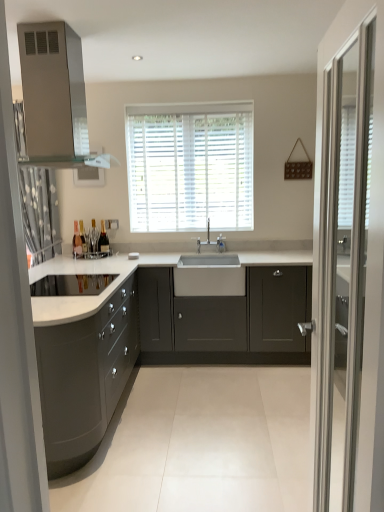
Question: From a real-world perspective, is satin nickel faucet at center over matte glass bottle at left, acting as the third bottle starting from the right?

Choices:
 (A) no
 (B) yes

Answer: (B)

Question: Is satin nickel faucet at center further to the viewer compared to matte glass bottle at left, acting as the third bottle starting from the right?

Choices:
 (A) no
 (B) yes

Answer: (B)

Question: Does satin nickel faucet at center have a larger size compared to matte glass bottle at left, acting as the third bottle starting from the right?

Choices:
 (A) no
 (B) yes

Answer: (B)

Question: Is matte glass bottle at left, which is the first bottle from left to right, completely or partially inside satin nickel faucet at center?

Choices:
 (A) yes
 (B) no

Answer: (B)

Question: Is satin nickel faucet at center turned away from matte glass bottle at left, which is the first bottle from left to right?

Choices:
 (A) no
 (B) yes

Answer: (A)

Question: Is satin nickel faucet at center shorter than matte glass bottle at left, which is the first bottle from left to right?

Choices:
 (A) yes
 (B) no

Answer: (B)

Question: Is matte gray cabinets at left, marked as the 1th cabinetry in a left-to-right arrangement, shorter than white blinds at center?

Choices:
 (A) no
 (B) yes

Answer: (B)

Question: Is matte gray cabinets at left, marked as the 1th cabinetry in a left-to-right arrangement, far from white blinds at center?

Choices:
 (A) yes
 (B) no

Answer: (A)

Question: Is matte gray cabinets at left, acting as the second cabinetry starting from the right, positioned before white blinds at center?

Choices:
 (A) yes
 (B) no

Answer: (A)

Question: Can you confirm if matte gray cabinets at left, marked as the 1th cabinetry in a left-to-right arrangement, is bigger than white blinds at center?

Choices:
 (A) no
 (B) yes

Answer: (B)

Question: Can you confirm if matte gray cabinets at left, marked as the 1th cabinetry in a left-to-right arrangement, is taller than white blinds at center?

Choices:
 (A) yes
 (B) no

Answer: (B)

Question: Is matte gray cabinets at left, acting as the second cabinetry starting from the right, oriented towards white blinds at center?

Choices:
 (A) yes
 (B) no

Answer: (B)

Question: Is matte gray cabinets at center, the 1th cabinetry positioned from the right, facing towards matte glass bottle at center, arranged as the 2th bottle when viewed from the left?

Choices:
 (A) yes
 (B) no

Answer: (B)